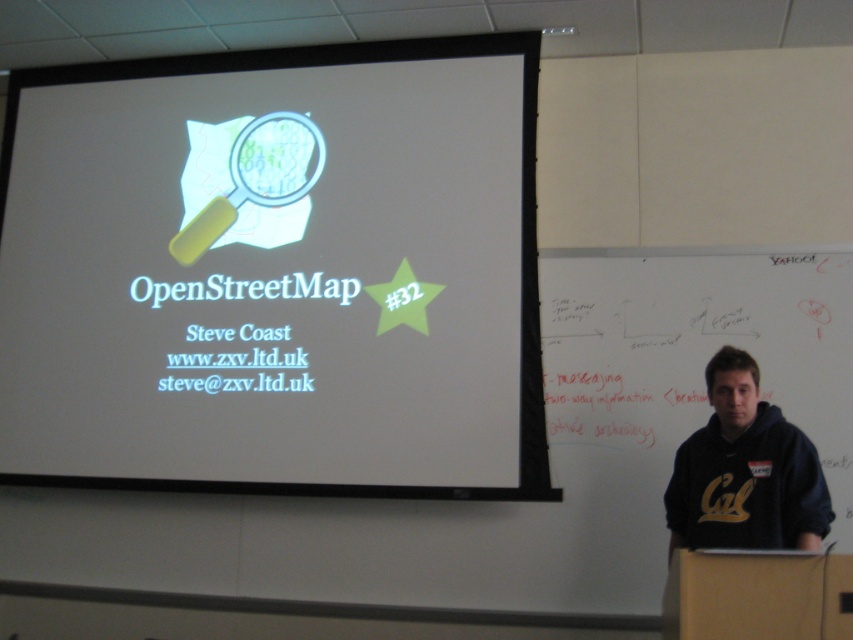
What is the spatial relationship between the white matte projection screen at upper center and the whiteboard at right in the presentation setting?

The white matte projection screen at upper center is positioned on the left side of whiteboard at right.